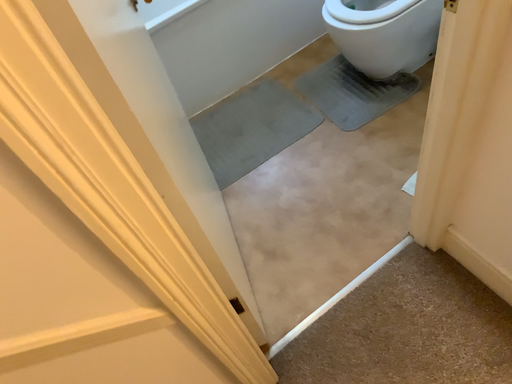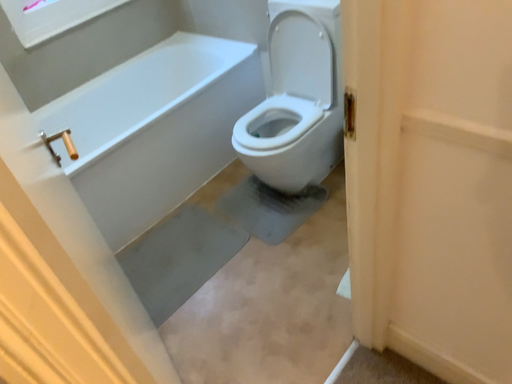
Question: Which way did the camera rotate in the video?

Choices:
 (A) rotated downward
 (B) rotated upward

Answer: (B)